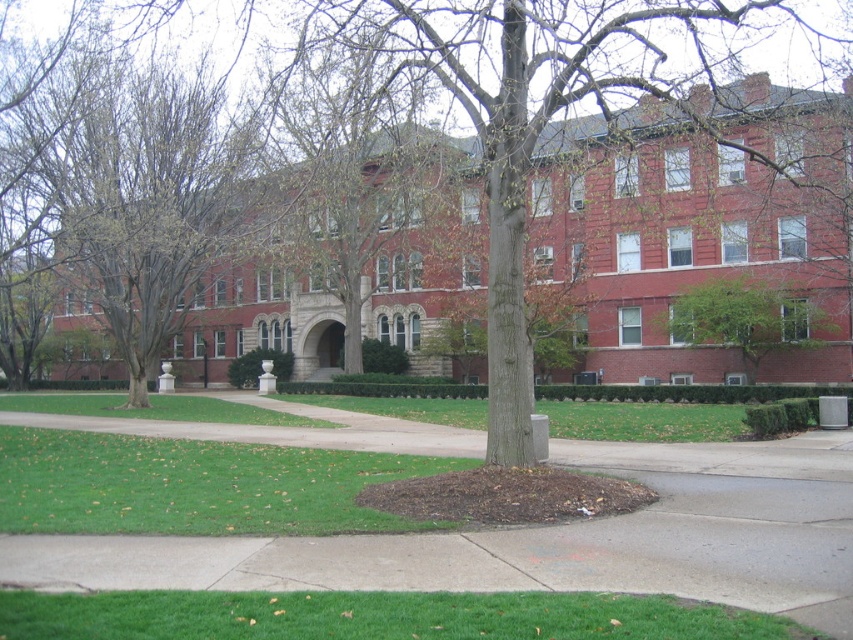
The width and height of the screenshot is (853, 640). Describe the element at coordinates (376, 616) in the screenshot. I see `green grass at lower center` at that location.

In the scene shown: Can you confirm if green grass at lower center is wider than green leafy tree at center?

Yes, green grass at lower center is wider than green leafy tree at center.

Locate an element on the screen. green grass at lower center is located at coordinates (376, 616).

Where is `green grass at lower center`? The width and height of the screenshot is (853, 640). green grass at lower center is located at coordinates (376, 616).

Is concrete at center positioned before green grass at center?

Yes, it is in front of green grass at center.

Does concrete at center appear on the right side of green grass at center?

Indeed, concrete at center is positioned on the right side of green grass at center.

Looking at this image, who is more distant from viewer, (705, 573) or (250, 420)?

The point (250, 420) is behind.

The width and height of the screenshot is (853, 640). I want to click on concrete at center, so click(x=544, y=540).

Between green grass at lower left and green grass at center, which one is positioned lower?

Positioned lower is green grass at center.

Does point (454, 460) lie behind point (190, 412)?

No.

This screenshot has width=853, height=640. What do you see at coordinates (193, 484) in the screenshot?
I see `green grass at lower left` at bounding box center [193, 484].

Identify the location of green grass at lower left. (193, 484).